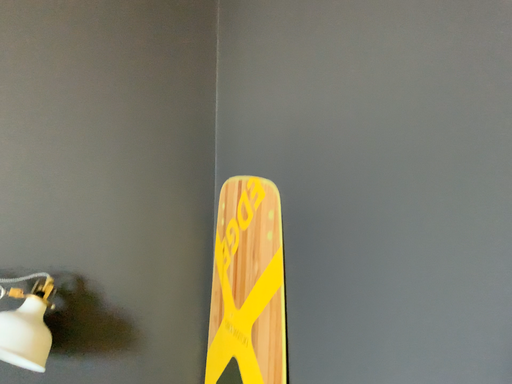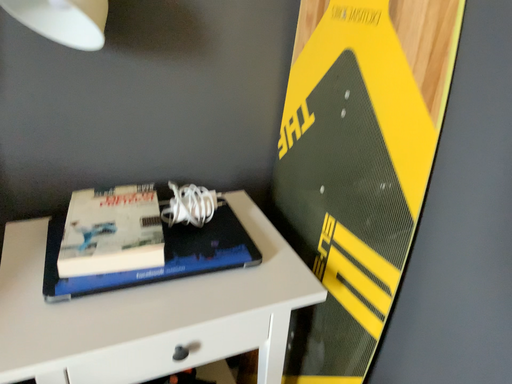
Question: How did the camera likely rotate when shooting the video?

Choices:
 (A) rotated downward
 (B) rotated upward

Answer: (A)